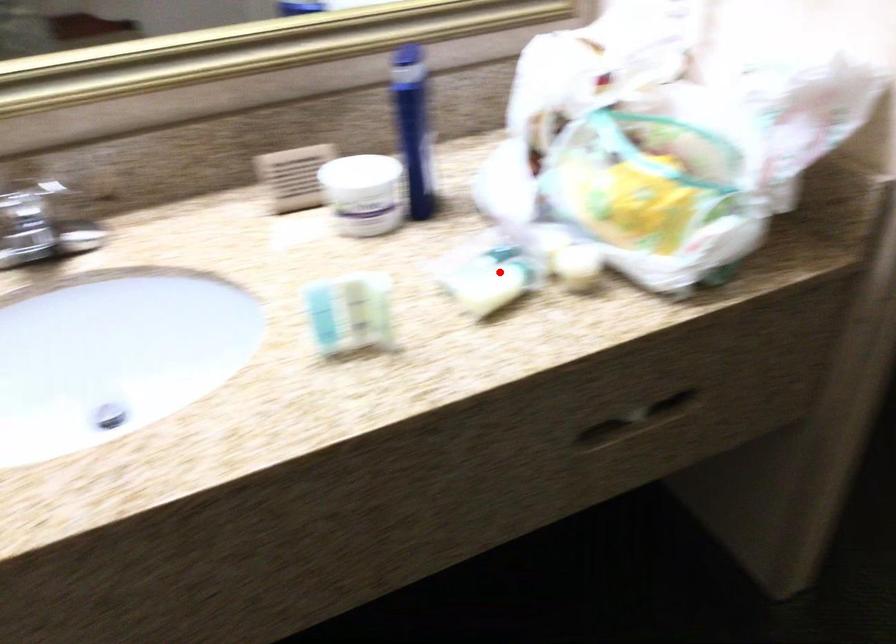
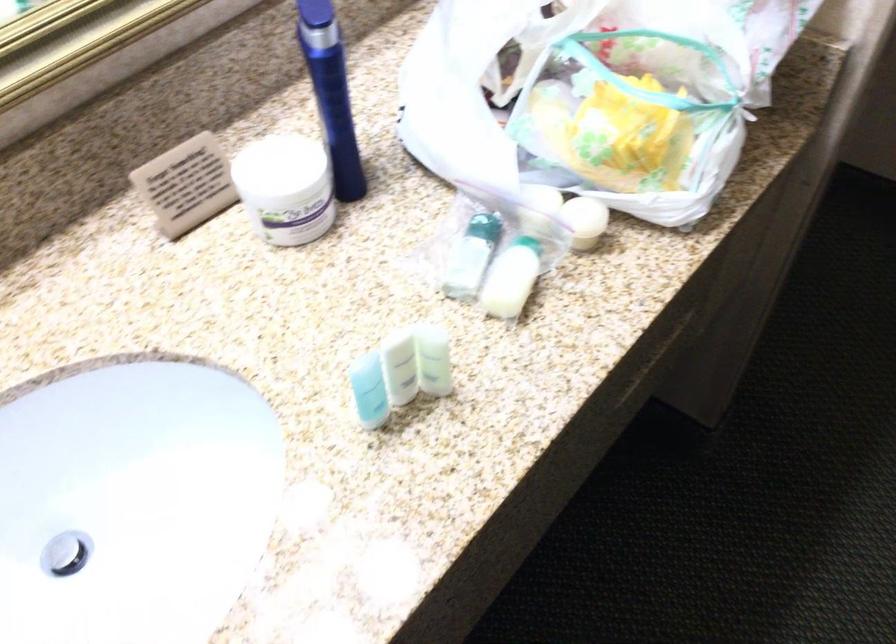
Question: I am providing you with two images of the same scene from different viewpoints. Given a red point in image1, look at the same physical point in image2. Is it:

Choices:
 (A) Closer to the viewpoint
 (B) Farther from the viewpoint

Answer: (A)